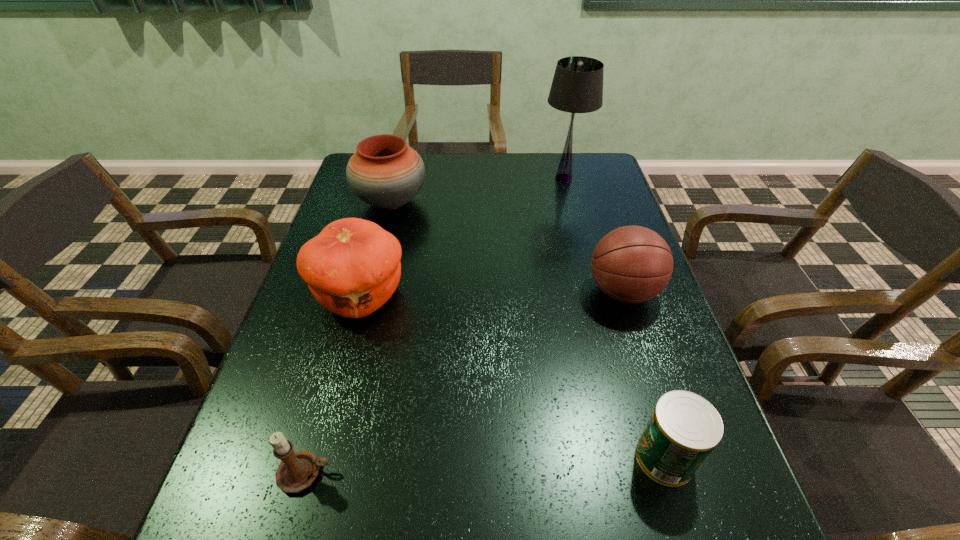
Locate an element on the screen. Image resolution: width=960 pixels, height=540 pixels. vacant area in the image that satisfies the following two spatial constraints: 1. on the front side of the pottery; 2. on the right side of the basketball is located at coordinates (369, 292).

Find the location of a particular element. free space that satisfies the following two spatial constraints: 1. on the back side of the basketball; 2. on the front-facing side of the lampshade is located at coordinates (586, 178).

At what (x,y) coordinates should I click in order to perform the action: click on vacant space that satisfies the following two spatial constraints: 1. on the front side of the can; 2. on the side of the candle holder with the handle. Please return your answer as a coordinate pair (x, y). This screenshot has height=540, width=960. Looking at the image, I should click on pyautogui.click(x=669, y=473).

This screenshot has height=540, width=960. Find the location of `vacant point that satisfies the following two spatial constraints: 1. on the front-facing side of the tallest object; 2. on the front side of the pottery`. vacant point that satisfies the following two spatial constraints: 1. on the front-facing side of the tallest object; 2. on the front side of the pottery is located at coordinates (570, 202).